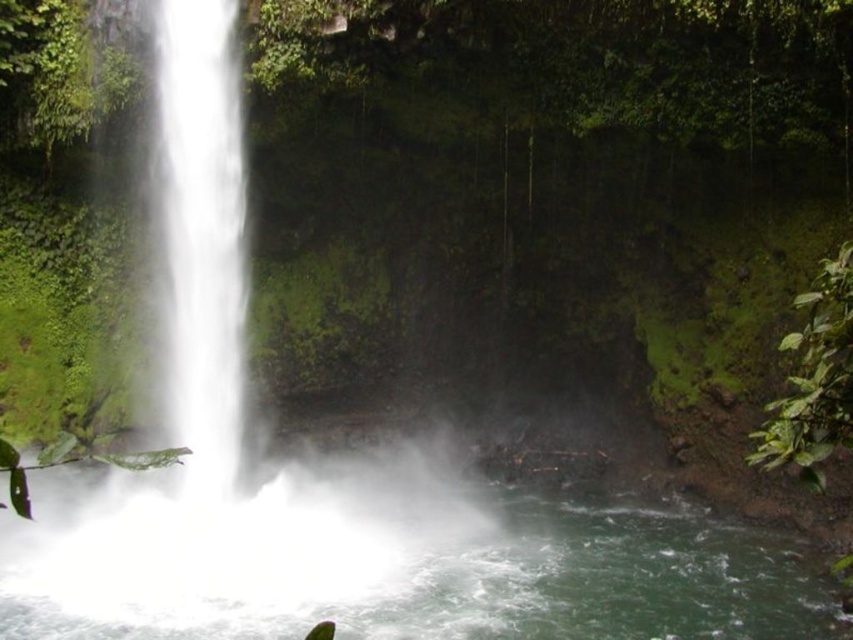
Question: Does white frothy water at center appear on the right side of white misty waterfall at left?

Choices:
 (A) yes
 (B) no

Answer: (A)

Question: Does white frothy water at center appear on the left side of white misty waterfall at left?

Choices:
 (A) no
 (B) yes

Answer: (A)

Question: Which point appears farthest from the camera in this image?

Choices:
 (A) (434, 625)
 (B) (218, 480)

Answer: (B)

Question: Considering the relative positions of white frothy water at center and white misty waterfall at left in the image provided, where is white frothy water at center located with respect to white misty waterfall at left?

Choices:
 (A) right
 (B) left

Answer: (A)

Question: Among these points, which one is farthest from the camera?

Choices:
 (A) (172, 300)
 (B) (329, 525)

Answer: (A)